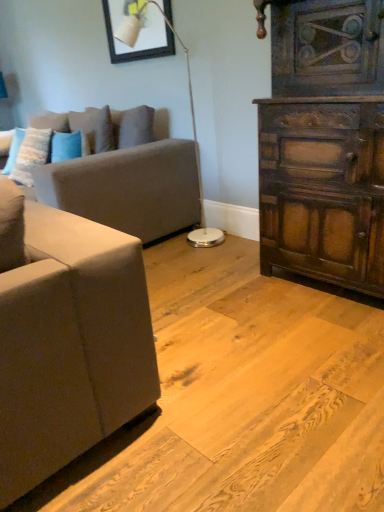
Question: Is matte black picture frame at upper center positioned with its back to matte gray couch at left?

Choices:
 (A) no
 (B) yes

Answer: (A)

Question: Is matte black picture frame at upper center thinner than matte gray couch at left?

Choices:
 (A) no
 (B) yes

Answer: (B)

Question: Does matte black picture frame at upper center have a lesser height compared to matte gray couch at left?

Choices:
 (A) no
 (B) yes

Answer: (B)

Question: Does matte black picture frame at upper center have a larger size compared to matte gray couch at left?

Choices:
 (A) yes
 (B) no

Answer: (B)

Question: Is matte black picture frame at upper center taller than matte gray couch at left?

Choices:
 (A) no
 (B) yes

Answer: (A)

Question: Is white glossy floor lamp at center wider or thinner than matte black picture frame at upper center?

Choices:
 (A) thin
 (B) wide

Answer: (B)

Question: From a real-world perspective, is white glossy floor lamp at center physically located above or below matte black picture frame at upper center?

Choices:
 (A) above
 (B) below

Answer: (B)

Question: Is point (218, 233) closer or farther from the camera than point (165, 12)?

Choices:
 (A) farther
 (B) closer

Answer: (A)

Question: From the image's perspective, is white glossy floor lamp at center located above or below matte black picture frame at upper center?

Choices:
 (A) above
 (B) below

Answer: (B)

Question: In terms of width, does matte gray couch at left look wider or thinner when compared to white glossy floor lamp at center?

Choices:
 (A) thin
 (B) wide

Answer: (B)

Question: Considering the positions of point (173, 174) and point (193, 131), is point (173, 174) closer or farther from the camera than point (193, 131)?

Choices:
 (A) closer
 (B) farther

Answer: (A)

Question: In terms of size, does matte gray couch at left appear bigger or smaller than white glossy floor lamp at center?

Choices:
 (A) small
 (B) big

Answer: (B)

Question: Is matte gray couch at left to the left or to the right of white glossy floor lamp at center in the image?

Choices:
 (A) left
 (B) right

Answer: (A)

Question: Considering the positions of blue plush pillow at upper left, which appears as the second pillow when viewed from the left, and matte gray couch at left in the image, is blue plush pillow at upper left, which appears as the second pillow when viewed from the left, taller or shorter than matte gray couch at left?

Choices:
 (A) tall
 (B) short

Answer: (B)

Question: Is point (92, 109) closer or farther from the camera than point (124, 112)?

Choices:
 (A) farther
 (B) closer

Answer: (A)